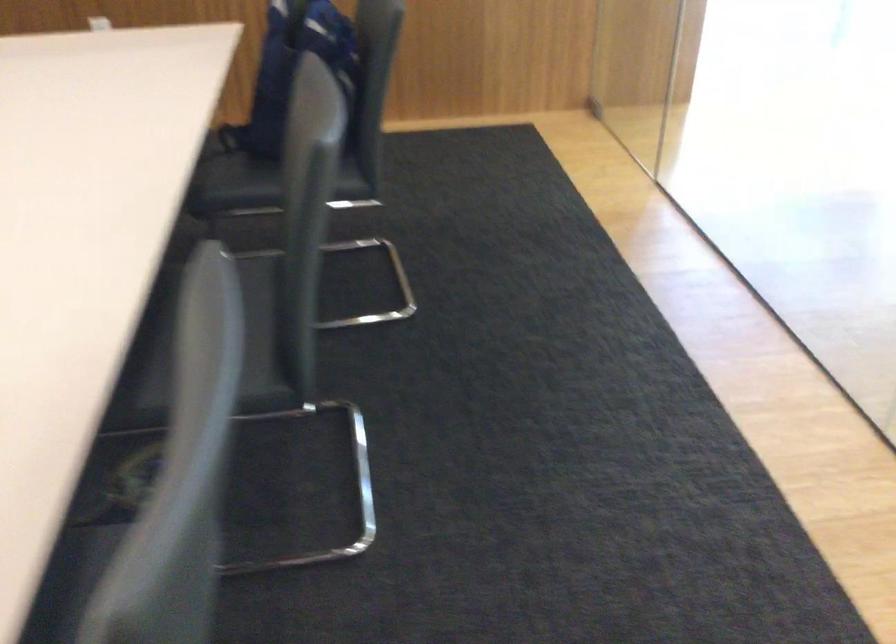
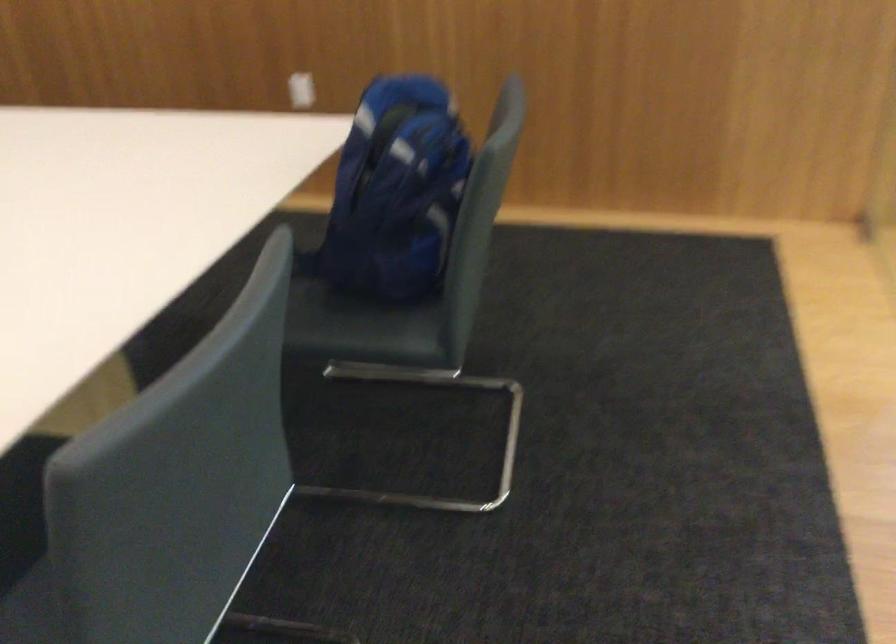
Question: The images are taken continuously from a first-person perspective. In which direction is your viewpoint rotating?

Choices:
 (A) Left
 (B) Right
 (C) Up
 (D) Down

Answer: (A)